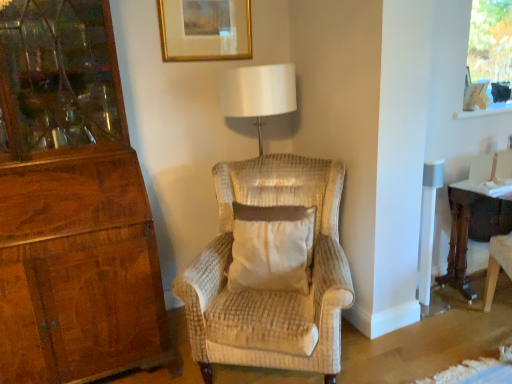
Identify the location of gold-framed picture at upper center. The height and width of the screenshot is (384, 512). (205, 30).

What is the approximate height of transparent glass window screen at upper right?

It is 26.60 inches.

Identify the location of dark brown wood desk at right. (467, 232).

From the image's perspective, relative to dark brown wood desk at right, is white textured pillow at center above or below?

Based on their image positions, white textured pillow at center is located beneath dark brown wood desk at right.

How far apart are white textured pillow at center and dark brown wood desk at right?

white textured pillow at center and dark brown wood desk at right are 4.21 feet apart from each other.

Considering the sizes of objects white textured pillow at center and dark brown wood desk at right in the image provided, who is shorter, white textured pillow at center or dark brown wood desk at right?

Standing shorter between the two is white textured pillow at center.

Is white textured pillow at center facing towards gold-framed picture at upper center?

No, white textured pillow at center is not aimed at gold-framed picture at upper center.

Between white textured pillow at center and gold-framed picture at upper center, which one has smaller width?

gold-framed picture at upper center is thinner.

Is white textured pillow at center bigger or smaller than gold-framed picture at upper center?

white textured pillow at center is bigger than gold-framed picture at upper center.

Is dark brown wood desk at right at the back of transparent glass window screen at upper right?

No, transparent glass window screen at upper right is not facing the opposite direction of dark brown wood desk at right.

Is point (488, 65) less distant than point (452, 190)?

No, (488, 65) is behind (452, 190).

Is dark brown wood desk at right located within transparent glass window screen at upper right?

That's incorrect, dark brown wood desk at right is not inside transparent glass window screen at upper right.

From the image's perspective, which one is positioned lower, dark brown wood desk at right or gold-framed picture at upper center?

dark brown wood desk at right, from the image's perspective.

From a real-world perspective, does dark brown wood desk at right sit lower than gold-framed picture at upper center?

Yes.

Considering the positions of objects dark brown wood desk at right and gold-framed picture at upper center in the image provided, who is more to the left, dark brown wood desk at right or gold-framed picture at upper center?

From the viewer's perspective, gold-framed picture at upper center appears more on the left side.

Is dark brown wood desk at right inside or outside of gold-framed picture at upper center?

dark brown wood desk at right is spatially situated outside gold-framed picture at upper center.

Can you confirm if white textured pillow at center is shorter than transparent glass window screen at upper right?

Yes.

Is white textured pillow at center smaller than transparent glass window screen at upper right?

Incorrect, white textured pillow at center is not smaller in size than transparent glass window screen at upper right.

Which object is positioned more to the right, white textured pillow at center or transparent glass window screen at upper right?

transparent glass window screen at upper right is more to the right.

From the image's perspective, which one is positioned higher, white textured pillow at center or transparent glass window screen at upper right?

From the image's view, transparent glass window screen at upper right is above.

Identify the location of picture frame below the transparent glass window screen at upper right (from the image's perspective). This screenshot has width=512, height=384. pos(205,30).

Can you tell me how much transparent glass window screen at upper right and gold-framed picture at upper center differ in facing direction?

The angle between the facing direction of transparent glass window screen at upper right and the facing direction of gold-framed picture at upper center is 0.878 degrees.

Can you confirm if transparent glass window screen at upper right is taller than gold-framed picture at upper center?

Yes.

Is transparent glass window screen at upper right located outside gold-framed picture at upper center?

transparent glass window screen at upper right lies outside gold-framed picture at upper center's area.

Is dark brown wood desk at right bigger or smaller than white textured pillow at center?

Considering their sizes, dark brown wood desk at right takes up more space than white textured pillow at center.

Could white textured pillow at center be considered to be inside dark brown wood desk at right?

No, white textured pillow at center is not inside dark brown wood desk at right.

Could you tell me if dark brown wood desk at right is facing white textured pillow at center?

No, dark brown wood desk at right is not aimed at white textured pillow at center.

Which object is closer to the camera taking this photo, dark brown wood desk at right or white textured pillow at center?

white textured pillow at center.

Find the location of a particular element. Image resolution: width=512 pixels, height=384 pixels. desk located behind the white textured pillow at center is located at coordinates (467, 232).

At what (x,y) coordinates should I click in order to perform the action: click on pillow that appears below the gold-framed picture at upper center (from a real-world perspective). Please return your answer as a coordinate pair (x, y). Looking at the image, I should click on (271, 248).

Estimate the real-world distances between objects in this image. Which object is closer to dark brown wood desk at right, transparent glass window screen at upper right or gold-framed picture at upper center?

The object closer to dark brown wood desk at right is transparent glass window screen at upper right.

Considering their positions, is gold-framed picture at upper center positioned further to dark brown wood desk at right than white textured pillow at center?

The object further to dark brown wood desk at right is gold-framed picture at upper center.

Considering their positions, is dark brown wood desk at right positioned closer to transparent glass window screen at upper right than white textured pillow at center?

dark brown wood desk at right.

Based on their spatial positions, is white textured pillow at center or dark brown wood desk at right further from gold-framed picture at upper center?

Based on the image, dark brown wood desk at right appears to be further to gold-framed picture at upper center.

Looking at the image, which one is located closer to dark brown wood desk at right, white textured pillow at center or transparent glass window screen at upper right?

The object closer to dark brown wood desk at right is transparent glass window screen at upper right.

Estimate the real-world distances between objects in this image. Which object is closer to white textured pillow at center, dark brown wood desk at right or gold-framed picture at upper center?

gold-framed picture at upper center is closer to white textured pillow at center.

Looking at the image, which one is located further to transparent glass window screen at upper right, dark brown wood desk at right or gold-framed picture at upper center?

Based on the image, gold-framed picture at upper center appears to be further to transparent glass window screen at upper right.

Estimate the real-world distances between objects in this image. Which object is closer to white textured pillow at center, gold-framed picture at upper center or transparent glass window screen at upper right?

gold-framed picture at upper center lies closer to white textured pillow at center than the other object.

Where is `pillow located between gold-framed picture at upper center and dark brown wood desk at right in the left-right direction`? The width and height of the screenshot is (512, 384). pillow located between gold-framed picture at upper center and dark brown wood desk at right in the left-right direction is located at coordinates (271, 248).

Find the location of a particular element. The height and width of the screenshot is (384, 512). desk located between white textured pillow at center and transparent glass window screen at upper right in the left-right direction is located at coordinates [467, 232].

This screenshot has width=512, height=384. Identify the location of desk located between gold-framed picture at upper center and transparent glass window screen at upper right in the left-right direction. (467, 232).

What are the coordinates of `pillow between gold-framed picture at upper center and transparent glass window screen at upper right from left to right` in the screenshot? It's located at (271, 248).